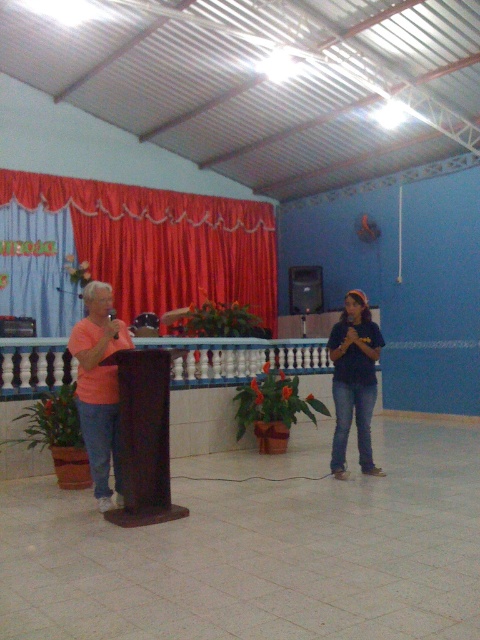
You are attending a meeting in the community hall and need to present your slides. The screen is located at the back of the room. To ensure you can see the screen clearly while speaking, should you stand behind the brown polished wood podium at center or move to where the matte orange shirt at left is standing?

The brown polished wood podium at center is below matte orange shirt at left, meaning the podium is closer to the screen. Therefore, standing behind the brown polished wood podium at center would allow you to see the screen better.

You are planning to set up a camera to capture both the brown polished wood podium at center and the matte orange shirt at left. Since the camera has a fixed height, which object should be placed closer to the camera to ensure both are in focus?

The brown polished wood podium at center is shorter than the matte orange shirt at left. To ensure both are in focus, place the podium closer to the camera so that the height difference is minimized.

You are an event planner setting up for a presentation. You need to ensure that the red velvet curtain at upper left and the matte orange shirt at left are visible to the audience. Which object should you adjust to avoid blocking the view of the other?

The red velvet curtain at upper left is much taller than the matte orange shirt at left, so you should lower the red velvet curtain at upper left to ensure the matte orange shirt at left is visible to the audience.